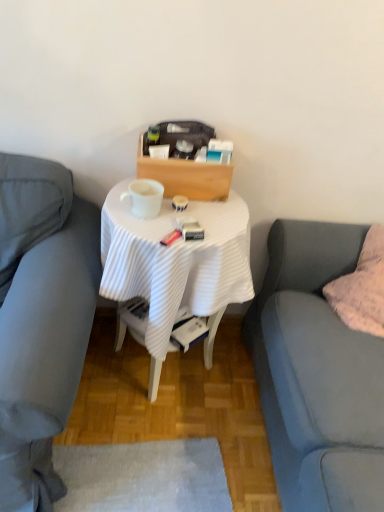
Question: From a real-world perspective, is white ribbed cloth at center above or below matte gray couch at left, the second studio couch viewed from the right?

Choices:
 (A) above
 (B) below

Answer: (B)

Question: Would you say white ribbed cloth at center is to the left or to the right of matte gray couch at left, placed as the 1th studio couch when sorted from left to right, in the picture?

Choices:
 (A) right
 (B) left

Answer: (A)

Question: Which of these objects is positioned farthest from the matte gray couch at left, placed as the 1th studio couch when sorted from left to right?

Choices:
 (A) white glossy mug at center
 (B) soft gray fabric couch at right, marked as the first studio couch in a right-to-left arrangement
 (C) fluffy pink pillow at right
 (D) white ribbed cloth at center

Answer: (C)

Question: Which object is the closest to the fluffy pink pillow at right?

Choices:
 (A) white ribbed cloth at center
 (B) white glossy mug at center
 (C) matte gray couch at left, the second studio couch viewed from the right
 (D) soft gray fabric couch at right, the second studio couch in the left-to-right sequence

Answer: (D)